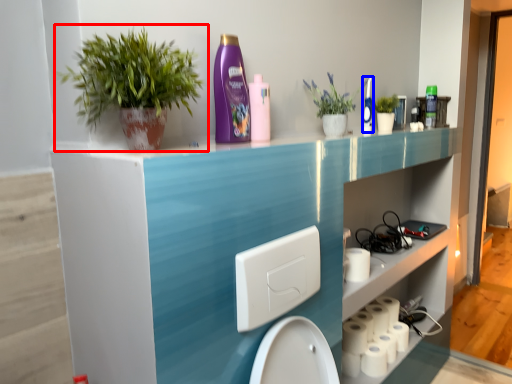
Question: Among these objects, which one is nearest to the camera, houseplant (highlighted by a red box) or cleaning product (highlighted by a blue box)?

Choices:
 (A) houseplant
 (B) cleaning product

Answer: (A)